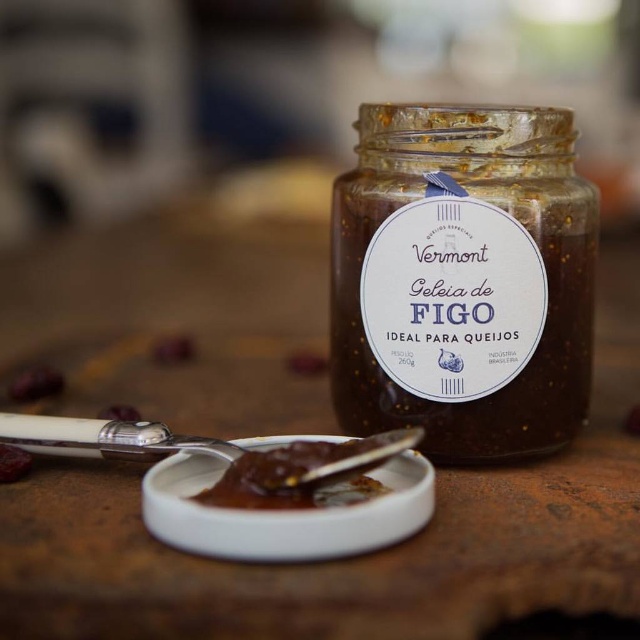
What is the exact location of the brown gelatinous substance at center in the image?

The brown gelatinous substance at center is located at point [291,477].

You are a chef preparing a tasting menu and need to place the white ceramic spoon at lower center exactly at the center of the jar of fig jam. Given its current position at point 0.686, 0.166, how far to the left or right should you move it to align it with the jar?

The white ceramic spoon at lower center is currently at point (106, 438). To center it with the jar, you would need to move it to the left by 0.186 units since the jar is positioned at 0.5 on the horizontal axis.

You are a chef preparing a tasting menu and need to decide where to place the brown gelatinous substance at center and the brown matte fig jam at center on the menu based on their positions in the image. Which one should be listed first?

The brown gelatinous substance at center is located below the brown matte fig jam at center, so the brown matte fig jam at center should be listed first on the menu to reflect its higher position in the image.